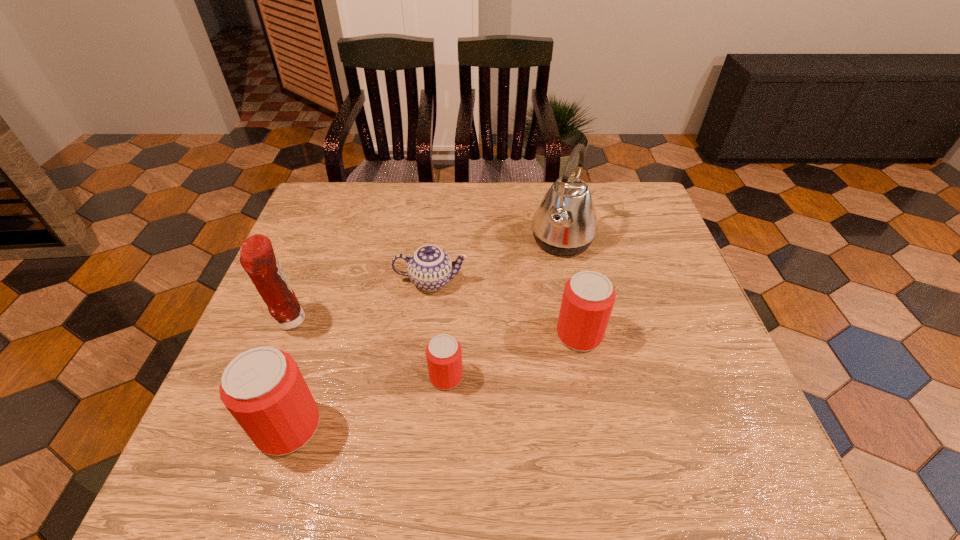
Identify the location of beer can that is the third closest one to the condiment. This screenshot has width=960, height=540. (588, 298).

Identify which beer can is located as the second nearest to the leftmost beer can. Please provide its 2D coordinates. Your answer should be formatted as a tuple, i.e. [(x, y)], where the tuple contains the x and y coordinates of a point satisfying the conditions above.

[(588, 298)]

Identify the location of blank space that satisfies the following two spatial constraints: 1. on the back side of the condiment; 2. on the right side of the kettle. tap(322, 240).

Find the location of a particular element. free point that satisfies the following two spatial constraints: 1. on the back side of the shortest beer can; 2. on the left side of the farthest beer can is located at coordinates [x=448, y=335].